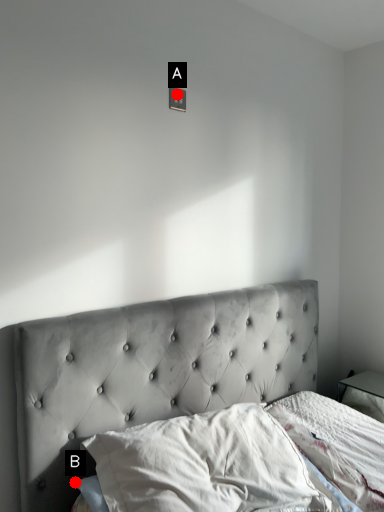
Question: Two points are circled on the image, labeled by A and B beside each circle. Among these points, which one is farthest from the camera?

Choices:
 (A) A is further
 (B) B is further

Answer: (A)